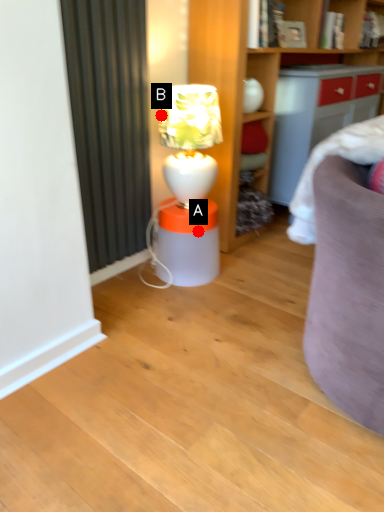
Question: Two points are circled on the image, labeled by A and B beside each circle. Among these points, which one is nearest to the camera?

Choices:
 (A) A is closer
 (B) B is closer

Answer: (B)